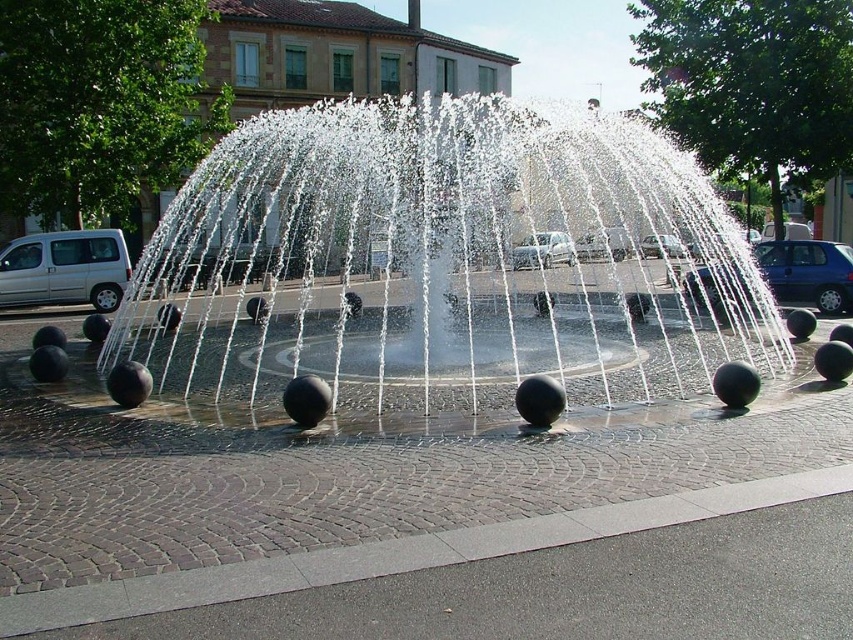
Looking at this image, you are standing at the center of the fountain and want to exit the plaza towards the road. Which direction should you walk to reach the silver metallic van at left?

Since the silver metallic van at left is located at point (x=64, y=269), you should walk towards the left direction to reach it from the center of the fountain.

You are standing at the center of the square and want to place a new decorative element exactly at the location of the black polished spheres at center. What are the coordinates where you should place it?

The coordinates for the black polished spheres at center are at point (434, 262), so you should place the new decorative element at those exact coordinates.

You are a pedestrian standing at the edge of the fountain area. You see the black polished spheres at center and the silver metallic car at center. Which object is closer to you?

The black polished spheres at center is positioned over the silver metallic car at center, so the black polished spheres at center is closer to you.